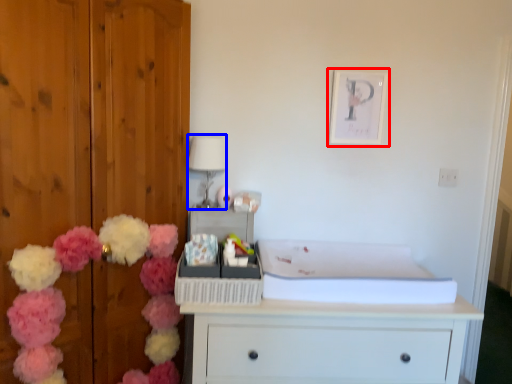
Question: Which object appears closest to the camera in this image, picture frame (highlighted by a red box) or lamp (highlighted by a blue box)?

Choices:
 (A) picture frame
 (B) lamp

Answer: (B)